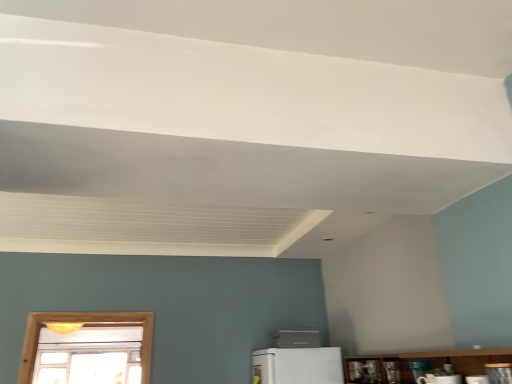
Question: From the image's perspective, is metallic silver toaster at lower right, which appears as the fourth appliance when ordered from the bottom, located above or below white glossy microwave at lower center, which is the third appliance in back-to-front order?

Choices:
 (A) below
 (B) above

Answer: (B)

Question: From a real-world perspective, is metallic silver toaster at lower right, which appears as the fourth appliance when ordered from the bottom, above or below white glossy microwave at lower center, arranged as the second appliance when viewed from the front?

Choices:
 (A) above
 (B) below

Answer: (A)

Question: Which is farther from the metallic silver toaster at lower right, which is the 2th appliance from bottom to top?

Choices:
 (A) wooden at lower right
 (B) white glossy microwave at lower center, the 3th appliance viewed from the right
 (C) white plastic air conditioner at center, which appears as the 1th appliance when viewed from the back
 (D) metallic silver toaster at lower right, the second appliance viewed from the right

Answer: (C)

Question: Which is nearer to the white plastic air conditioner at center, the first appliance from the bottom?

Choices:
 (A) metallic silver toaster at lower right, arranged as the 3th appliance when viewed from the front
 (B) wooden at lower right
 (C) metallic silver toaster at lower right, which ranks as the 1th appliance in top-to-bottom order
 (D) white glossy microwave at lower center, the second appliance from the top

Answer: (B)